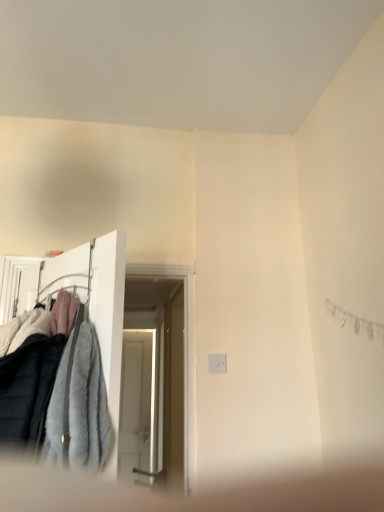
Question: Should I look upward or downward to see fuzzy fabric coat at left?

Choices:
 (A) up
 (B) down

Answer: (B)